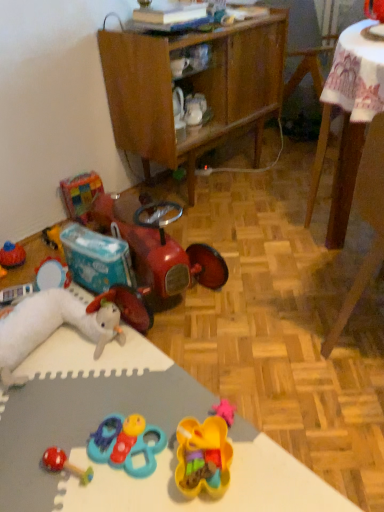
In order to click on vacant region to the left of teal plastic toy at center, positioned as the 3th toy in right-to-left order in this screenshot , I will do `click(62, 441)`.